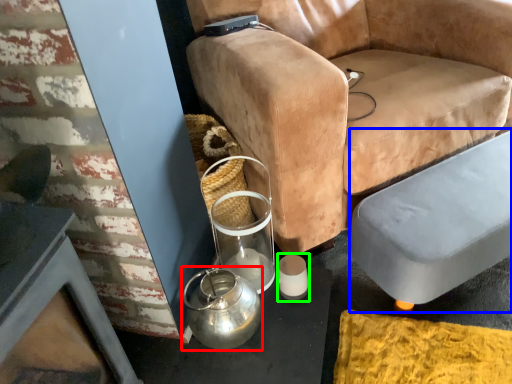
Question: Which object is the farthest from tea pot (highlighted by a red box)? Choose among these: swivel chair (highlighted by a blue box) or candle holder (highlighted by a green box).

Choices:
 (A) swivel chair
 (B) candle holder

Answer: (A)